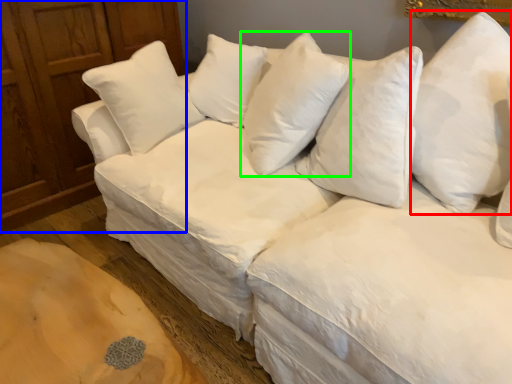
Question: Estimate the real-world distances between objects in this image. Which object is farther from pillow (highlighted by a red box), dresser (highlighted by a blue box) or pillow (highlighted by a green box)?

Choices:
 (A) dresser
 (B) pillow

Answer: (A)